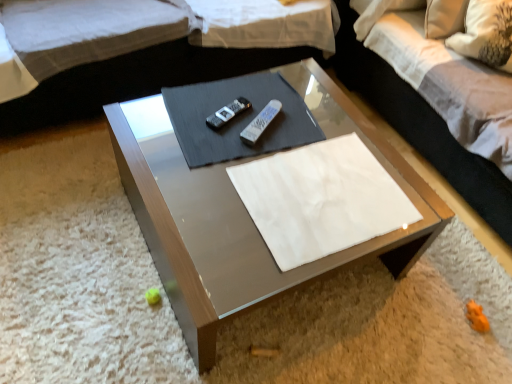
Locate an element on the screen. The image size is (512, 384). free spot below white paper at center (from a real-world perspective) is located at coordinates (328, 196).